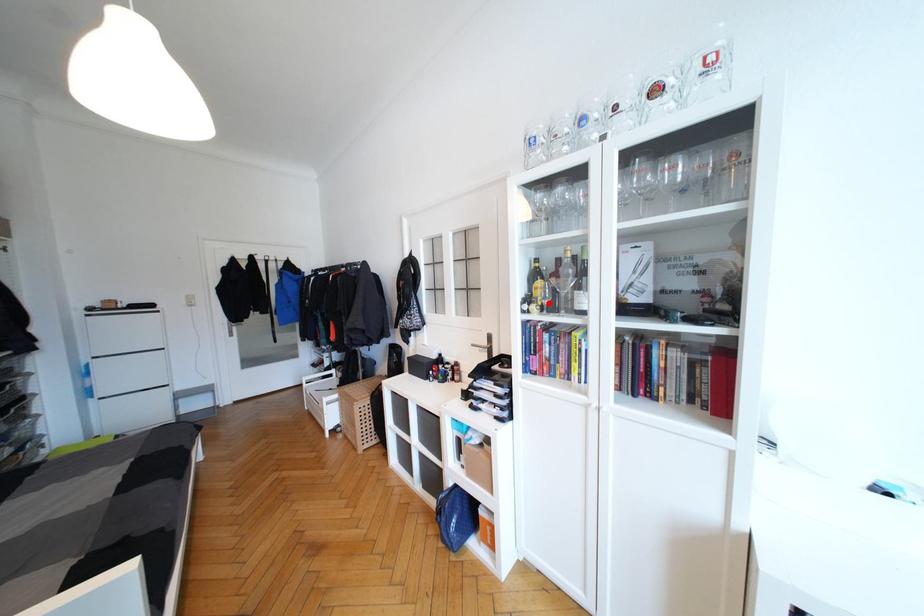
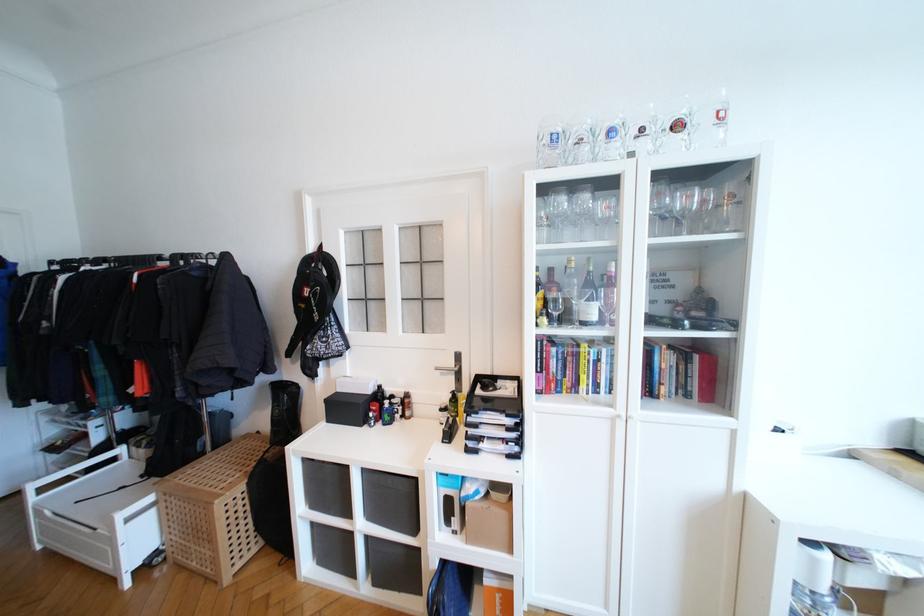
Locate, in the second image, the point that corresponds to the highlighted location in the first image.

(558, 315)